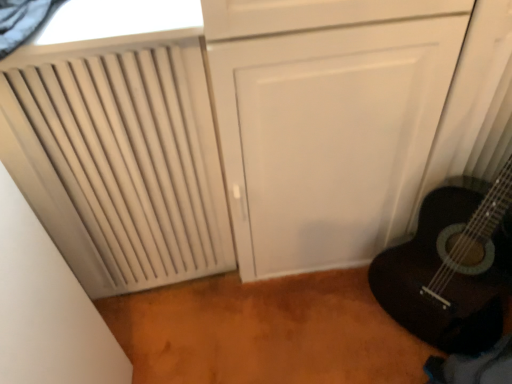
Question: Is black mesh curtain at upper left inside or outside of beige matte radiator at left?

Choices:
 (A) outside
 (B) inside

Answer: (A)

Question: Based on their positions, is black mesh curtain at upper left located to the left or right of beige matte radiator at left?

Choices:
 (A) left
 (B) right

Answer: (B)

Question: Which is farther from the beige matte radiator at left?

Choices:
 (A) black mesh curtain at upper left
 (B) white textured window at upper left

Answer: (A)

Question: Which object is positioned farthest from the white textured window at upper left?

Choices:
 (A) black mesh curtain at upper left
 (B) beige matte radiator at left

Answer: (B)